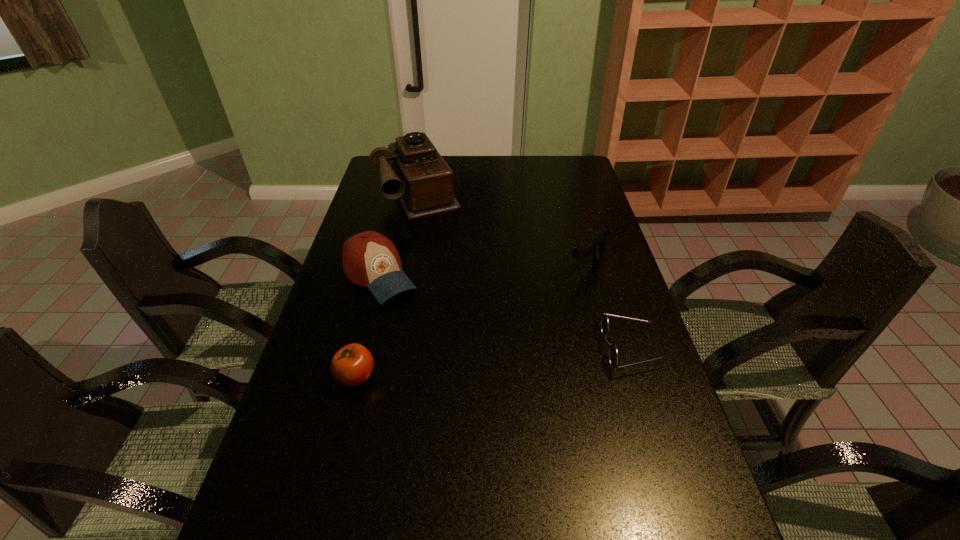
Find the location of a particular element. This screenshot has width=960, height=540. vacant space that is in between the tallest object and the pistol is located at coordinates (503, 228).

The width and height of the screenshot is (960, 540). Identify the location of free point between the tallest object and the pistol. (503, 228).

The image size is (960, 540). Find the location of `free space between the farthest object and the shortest object`. free space between the farthest object and the shortest object is located at coordinates (524, 270).

The height and width of the screenshot is (540, 960). Find the location of `blank region between the shortest object and the baseball cap`. blank region between the shortest object and the baseball cap is located at coordinates (504, 312).

Find the location of a particular element. This screenshot has height=540, width=960. blank region between the pistol and the baseball cap is located at coordinates (484, 271).

What are the coordinates of `vacant area that lies between the tallest object and the shortest object` in the screenshot? It's located at (524, 270).

Find the location of `object that ranks as the second closest to the phonograph_record`. object that ranks as the second closest to the phonograph_record is located at coordinates (594, 245).

You are a GUI agent. You are given a task and a screenshot of the screen. Output one action in this format:
    pyautogui.click(x=<x>, y=<y>)
    Task: Click on the object that is the third closest one to the baseball cap
    The height and width of the screenshot is (540, 960).
    Given the screenshot: What is the action you would take?
    pyautogui.click(x=594, y=245)

Locate an element on the screen. This screenshot has height=540, width=960. vacant space that satisfies the following two spatial constraints: 1. on the front side of the phonograph_record; 2. on the front-facing side of the shortest object is located at coordinates (388, 349).

What are the coordinates of `free space that satisfies the following two spatial constraints: 1. on the front side of the shortest object; 2. on the front-facing side of the pistol` in the screenshot? It's located at [x=611, y=349].